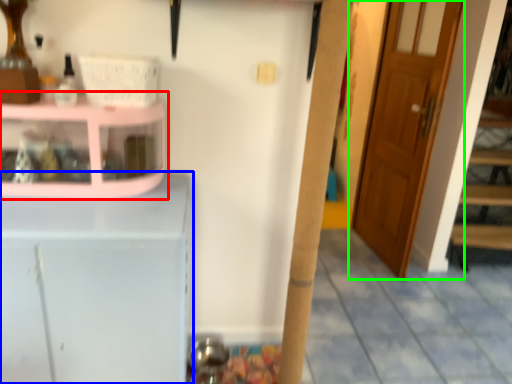
Question: Which object is positioned closest to shelf (highlighted by a red box)? Select from cabinetry (highlighted by a blue box) and door (highlighted by a green box).

Choices:
 (A) cabinetry
 (B) door

Answer: (A)